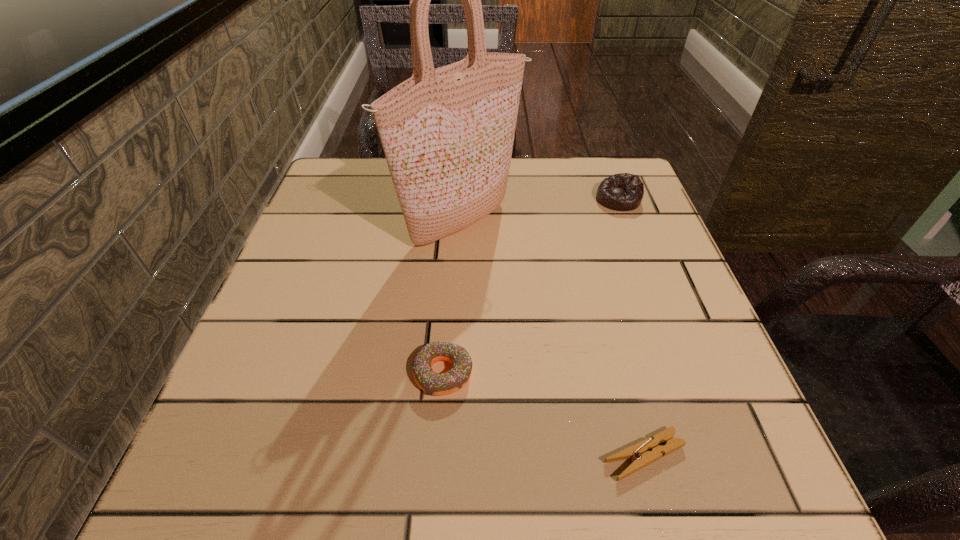
Identify the location of shopping bag present at the far edge. The image size is (960, 540). (447, 133).

I want to click on beanbag that is at the far edge, so [623, 192].

Where is `object at the near edge`? object at the near edge is located at coordinates (647, 451).

This screenshot has height=540, width=960. In order to click on beanbag that is positioned at the right edge in this screenshot , I will do `click(623, 192)`.

The height and width of the screenshot is (540, 960). Find the location of `clothespin that is at the right edge`. clothespin that is at the right edge is located at coordinates (647, 451).

The width and height of the screenshot is (960, 540). Find the location of `object situated at the far right corner`. object situated at the far right corner is located at coordinates (623, 192).

Locate an element on the screen. object that is at the near right corner is located at coordinates (647, 451).

Locate an element on the screen. The width and height of the screenshot is (960, 540). vacant position at the far edge of the desktop is located at coordinates (521, 193).

Where is `vacant space at the left edge of the desktop`? This screenshot has width=960, height=540. vacant space at the left edge of the desktop is located at coordinates (301, 260).

You are a GUI agent. You are given a task and a screenshot of the screen. Output one action in this format:
    pyautogui.click(x=<x>, y=<y>)
    Task: Click on the free space at the right edge of the desktop
    This screenshot has width=960, height=540.
    Given the screenshot: What is the action you would take?
    pyautogui.click(x=638, y=217)